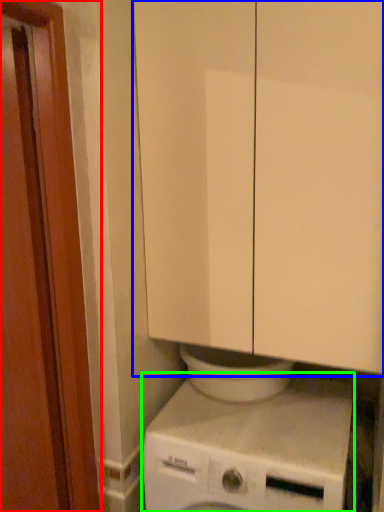
Question: Based on their relative distances, which object is farther from screen door (highlighted by a red box)? Choose from cabinetry (highlighted by a blue box) and washing machine (highlighted by a green box).

Choices:
 (A) cabinetry
 (B) washing machine

Answer: (B)